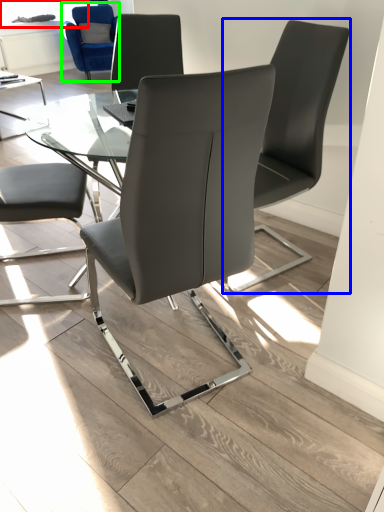
Question: Estimate the real-world distances between objects in this image. Which object is farther from window screen (highlighted by a red box), chair (highlighted by a blue box) or chair (highlighted by a green box)?

Choices:
 (A) chair
 (B) chair

Answer: (A)